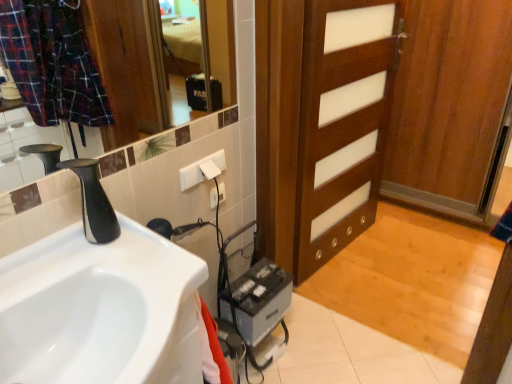
This screenshot has width=512, height=384. I want to click on white glossy sink at lower left, so click(x=101, y=310).

In order to face gray metallic battery at lower center, should I rotate leftwards or rightwards?

Turn right approximately 0.348 degrees to face it.

Measure the distance between white plastic electric outlet at upper center, the second electric outlet from the back, and camera.

white plastic electric outlet at upper center, the second electric outlet from the back, is 1.38 meters from camera.

Where is `black matte faucet at left`? black matte faucet at left is located at coordinates (93, 202).

Between gray metallic battery at lower center and white plastic electric outlet at upper center, the second electric outlet from the back, which one has smaller size?

Smaller between the two is white plastic electric outlet at upper center, the second electric outlet from the back.

Is gray metallic battery at lower center facing towards white plastic electric outlet at upper center, the second electric outlet from the back?

No, gray metallic battery at lower center does not turn towards white plastic electric outlet at upper center, the second electric outlet from the back.

Is gray metallic battery at lower center taller or shorter than white plastic electric outlet at upper center, the first electric outlet positioned from the front?

gray metallic battery at lower center is taller than white plastic electric outlet at upper center, the first electric outlet positioned from the front.

Is point (249, 281) more distant than point (190, 174)?

Yes, point (249, 281) is farther from viewer.

Is black matte faucet at left looking in the opposite direction of white plastic electric outlet at upper center, the first electric outlet positioned from the front?

No, black matte faucet at left is not facing the opposite direction of white plastic electric outlet at upper center, the first electric outlet positioned from the front.

How distant is black matte faucet at left from white plastic electric outlet at upper center, the first electric outlet positioned from the front?

black matte faucet at left is 14.72 inches from white plastic electric outlet at upper center, the first electric outlet positioned from the front.

From a real-world perspective, is black matte faucet at left beneath white plastic electric outlet at upper center, the second electric outlet from the back?

Actually, black matte faucet at left is physically above white plastic electric outlet at upper center, the second electric outlet from the back, in the real world.

What's the angular difference between black matte faucet at left and white plastic electric outlet at upper center, which appears as the second electric outlet when viewed from the front,'s facing directions?

The facing directions of black matte faucet at left and white plastic electric outlet at upper center, which appears as the second electric outlet when viewed from the front, are 0.000968 degrees apart.

Is black matte faucet at left positioned beyond the bounds of white plastic electric outlet at upper center, which appears as the second electric outlet when viewed from the front?

That's correct, black matte faucet at left is outside of white plastic electric outlet at upper center, which appears as the second electric outlet when viewed from the front.

Are black matte faucet at left and white plastic electric outlet at upper center, which appears as the second electric outlet when viewed from the front, located far from each other?

No, black matte faucet at left is in close proximity to white plastic electric outlet at upper center, which appears as the second electric outlet when viewed from the front.

Which of these two, black matte faucet at left or white plastic electric outlet at upper center, which appears as the second electric outlet when viewed from the front, stands taller?

Standing taller between the two is black matte faucet at left.

In the image, is white plastic electric outlet at upper center, marked as the 1th electric outlet in a back-to-front arrangement, on the left side or the right side of white plastic electric outlet at upper center, the first electric outlet positioned from the front?

Based on their positions, white plastic electric outlet at upper center, marked as the 1th electric outlet in a back-to-front arrangement, is located to the right of white plastic electric outlet at upper center, the first electric outlet positioned from the front.

Do you think white plastic electric outlet at upper center, which appears as the second electric outlet when viewed from the front, is within white plastic electric outlet at upper center, the second electric outlet from the back, or outside of it?

white plastic electric outlet at upper center, which appears as the second electric outlet when viewed from the front, is spatially situated outside white plastic electric outlet at upper center, the second electric outlet from the back.

Is white plastic electric outlet at upper center, which appears as the second electric outlet when viewed from the front, facing away from white plastic electric outlet at upper center, the first electric outlet positioned from the front?

No, white plastic electric outlet at upper center, which appears as the second electric outlet when viewed from the front, is not facing away from white plastic electric outlet at upper center, the first electric outlet positioned from the front.

From the image's perspective, between wooden door at center and gray metallic battery at lower center, who is located below?

gray metallic battery at lower center.

Is gray metallic battery at lower center a part of wooden door at center?

No, gray metallic battery at lower center is not surrounded by wooden door at center.

From a real-world perspective, between wooden door at center and gray metallic battery at lower center, who is vertically higher?

From a 3D spatial view, wooden door at center is above.

Based on the photo, how far apart are wooden door at center and gray metallic battery at lower center?

The distance of wooden door at center from gray metallic battery at lower center is 25.18 inches.

Considering their positions, is white plastic electric outlet at upper center, the first electric outlet positioned from the front, located in front of or behind white plastic electric outlet at upper center, marked as the 1th electric outlet in a back-to-front arrangement?

white plastic electric outlet at upper center, the first electric outlet positioned from the front, is in front of white plastic electric outlet at upper center, marked as the 1th electric outlet in a back-to-front arrangement.

How many degrees apart are the facing directions of white plastic electric outlet at upper center, the second electric outlet from the back, and white plastic electric outlet at upper center, which appears as the second electric outlet when viewed from the front?

They differ by 0.00099 degrees in their facing directions.

Is white plastic electric outlet at upper center, the first electric outlet positioned from the front, positioned with its back to white plastic electric outlet at upper center, marked as the 1th electric outlet in a back-to-front arrangement?

white plastic electric outlet at upper center, the first electric outlet positioned from the front, does not have its back to white plastic electric outlet at upper center, marked as the 1th electric outlet in a back-to-front arrangement.

Locate an element on the screen. The height and width of the screenshot is (384, 512). electric outlet in front of the white plastic electric outlet at upper center, which appears as the second electric outlet when viewed from the front is located at coordinates (202, 170).

From the image's perspective, which is below, white glossy sink at lower left or black matte faucet at left?

From the image's view, white glossy sink at lower left is below.

Which object is positioned more to the right, white glossy sink at lower left or black matte faucet at left?

white glossy sink at lower left is more to the right.

Between white glossy sink at lower left and black matte faucet at left, which one is positioned in front?

Positioned in front is white glossy sink at lower left.

Which is farther, (x=169, y=289) or (x=106, y=213)?

The point (x=106, y=213) is more distant.

Find the location of `the 2nd electric outlet positioned above the gray metallic battery at lower center (from a real-world perspective)`. the 2nd electric outlet positioned above the gray metallic battery at lower center (from a real-world perspective) is located at coordinates (202, 170).

You are a GUI agent. You are given a task and a screenshot of the screen. Output one action in this format:
    pyautogui.click(x=<x>, y=<y>)
    Task: Click on the tap below the white plastic electric outlet at upper center, the second electric outlet from the back (from the image's perspective)
    The image size is (512, 384).
    Given the screenshot: What is the action you would take?
    pyautogui.click(x=93, y=202)

From the image, which object appears to be nearer to wooden door at center, white plastic electric outlet at upper center, the second electric outlet from the back, or white glossy sink at lower left?

Based on the image, white plastic electric outlet at upper center, the second electric outlet from the back, appears to be nearer to wooden door at center.

From the image, which object appears to be nearer to white plastic electric outlet at upper center, the second electric outlet from the back, wooden door at center or black matte faucet at left?

black matte faucet at left is closer to white plastic electric outlet at upper center, the second electric outlet from the back.

From the image, which object appears to be farther from white plastic electric outlet at upper center, marked as the 1th electric outlet in a back-to-front arrangement, wooden door at center or black matte faucet at left?

wooden door at center is positioned further to the anchor white plastic electric outlet at upper center, marked as the 1th electric outlet in a back-to-front arrangement.

Estimate the real-world distances between objects in this image. Which object is further from black matte faucet at left, gray metallic battery at lower center or white plastic electric outlet at upper center, which appears as the second electric outlet when viewed from the front?

gray metallic battery at lower center is further to black matte faucet at left.

Estimate the real-world distances between objects in this image. Which object is closer to white plastic electric outlet at upper center, marked as the 1th electric outlet in a back-to-front arrangement, gray metallic battery at lower center or black matte faucet at left?

Among the two, gray metallic battery at lower center is located nearer to white plastic electric outlet at upper center, marked as the 1th electric outlet in a back-to-front arrangement.

From the picture: From the image, which object appears to be nearer to gray metallic battery at lower center, black matte faucet at left or white glossy sink at lower left?

white glossy sink at lower left.

Which object lies further to the anchor point white plastic electric outlet at upper center, which appears as the second electric outlet when viewed from the front, black matte faucet at left or white glossy sink at lower left?

white glossy sink at lower left lies further to white plastic electric outlet at upper center, which appears as the second electric outlet when viewed from the front, than the other object.

Considering their positions, is white glossy sink at lower left positioned closer to gray metallic battery at lower center than black matte faucet at left?

white glossy sink at lower left.

Locate an element on the screen. electric outlet between white plastic electric outlet at upper center, the second electric outlet from the back, and gray metallic battery at lower center in the up-down direction is located at coordinates (213, 198).

Identify the location of sink between black matte faucet at left and wooden door at center from left to right. This screenshot has width=512, height=384. (101, 310).

In order to click on door between white glossy sink at lower left and white plastic electric outlet at upper center, marked as the 1th electric outlet in a back-to-front arrangement, along the z-axis in this screenshot , I will do [341, 123].

Identify the location of appliance between black matte faucet at left and wooden door at center from left to right. Image resolution: width=512 pixels, height=384 pixels. (261, 300).